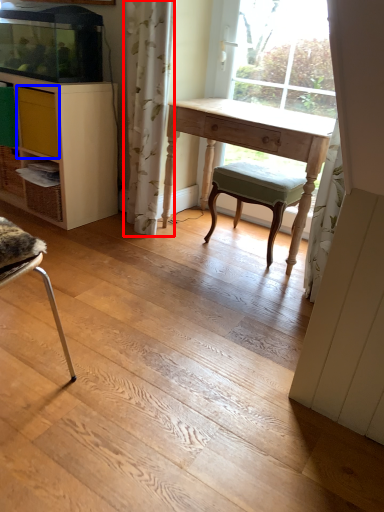
Question: Which point is further to the camera, curtain (highlighted by a red box) or drawer (highlighted by a blue box)?

Choices:
 (A) curtain
 (B) drawer

Answer: (B)